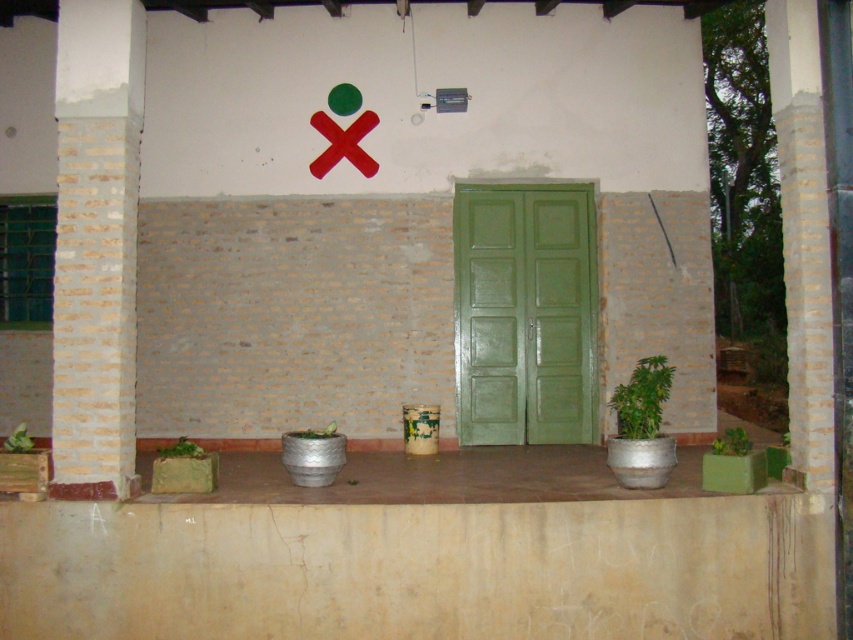
Question: Among these objects, which one is farthest from the camera?

Choices:
 (A) metallic silver pot at center
 (B) green metallic pot at lower right

Answer: (B)

Question: Can you confirm if metallic silver pot at center is positioned to the left of green matte pot at lower left?

Choices:
 (A) no
 (B) yes

Answer: (A)

Question: Based on their relative distances, which object is nearer to the green metallic pot at lower left?

Choices:
 (A) green metallic pot at lower center
 (B) metallic silver pot at center
 (C) green matte pot at lower left
 (D) green metallic pot at lower right

Answer: (B)

Question: From the image, what is the correct spatial relationship of brick textured pillar at left in relation to green metallic pot at right?

Choices:
 (A) left
 (B) right

Answer: (A)

Question: Which point appears farthest from the camera in this image?

Choices:
 (A) (471, 365)
 (B) (724, 452)

Answer: (A)

Question: Is brick textured pillar at left above green metallic pot at right?

Choices:
 (A) no
 (B) yes

Answer: (B)